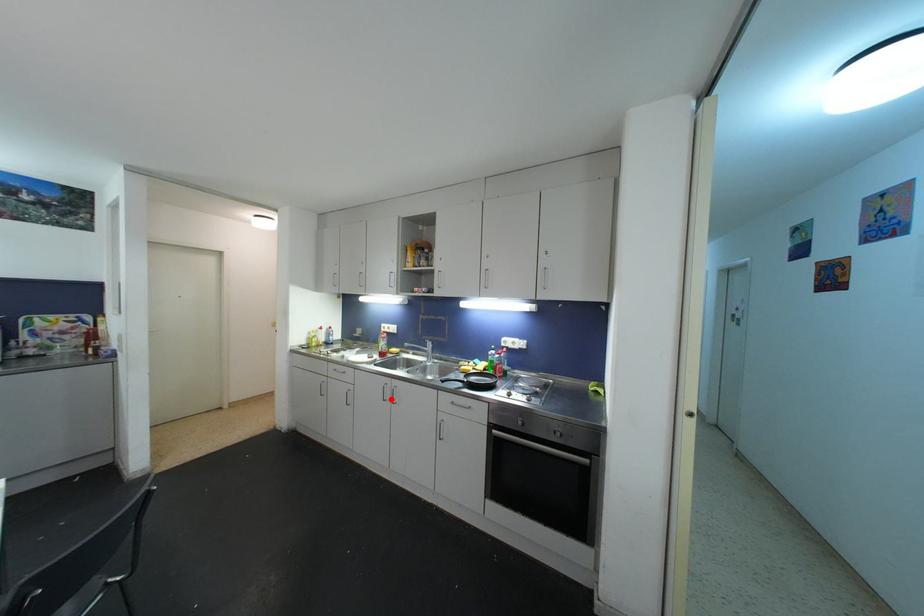
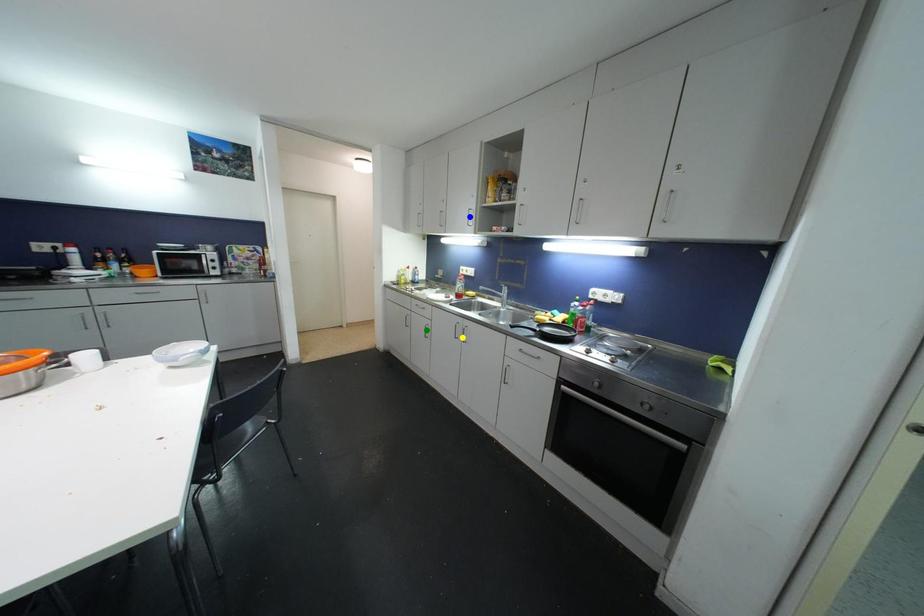
Question: I am providing you with two images of the same scene from different viewpoints. A red point is marked on the first image. You are given multiple points on the second image. In image 2, which mark is for the same physical point as the one in image 1?

Choices:
 (A) blue point
 (B) green point
 (C) yellow point

Answer: (C)